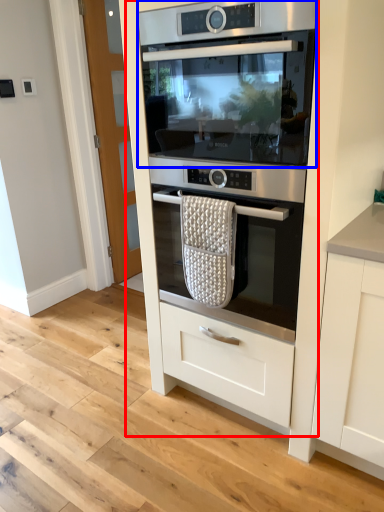
Question: Which point is closer to the camera, oven (highlighted by a red box) or home appliance (highlighted by a blue box)?

Choices:
 (A) oven
 (B) home appliance

Answer: (A)